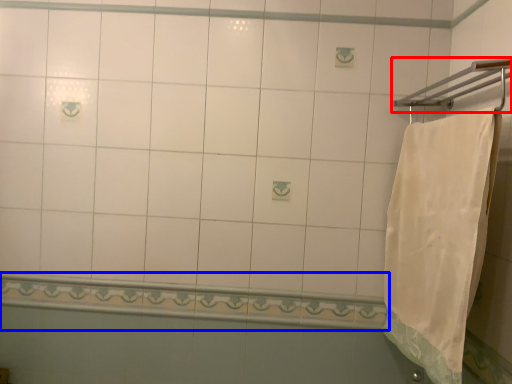
Question: Which object is further to the camera taking this photo, towel bar (highlighted by a red box) or balustrade (highlighted by a blue box)?

Choices:
 (A) towel bar
 (B) balustrade

Answer: (B)